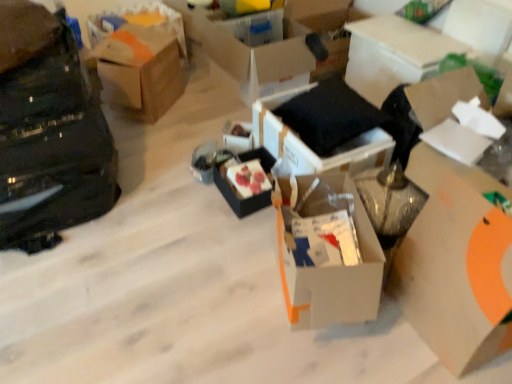
This screenshot has width=512, height=384. I want to click on vacant space in between brown cardboard box at upper left, arranged as the eighth box when viewed from the right, and black matte box at center, acting as the second box starting from the left, so click(x=181, y=132).